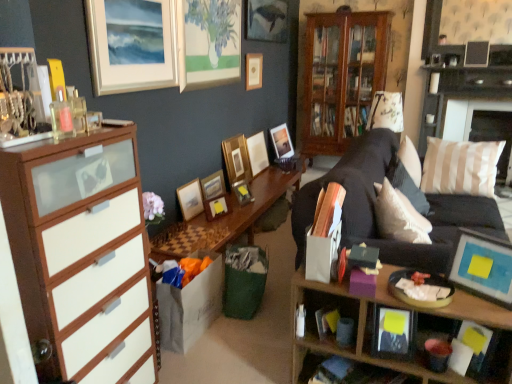
Question: Is wooden picture frame at upper center, which ranks as the 3th picture frame in back-to-front order, in contact with matte wooden picture frame at upper center, which ranks as the first picture frame in back-to-front order?

Choices:
 (A) no
 (B) yes

Answer: (A)

Question: From the image's perspective, is wooden picture frame at upper center, which ranks as the 3th picture frame in back-to-front order, located beneath matte wooden picture frame at upper center, which ranks as the first picture frame in back-to-front order?

Choices:
 (A) no
 (B) yes

Answer: (A)

Question: Are wooden picture frame at upper center, which ranks as the 3th picture frame in back-to-front order, and matte wooden picture frame at upper center, which ranks as the first picture frame in back-to-front order, located far from each other?

Choices:
 (A) yes
 (B) no

Answer: (B)

Question: Is matte wooden picture frame at upper center, which ranks as the first picture frame in back-to-front order, surrounded by wooden picture frame at upper center, placed as the ninth picture frame when sorted from front to back?

Choices:
 (A) no
 (B) yes

Answer: (A)

Question: Is wooden picture frame at upper center, placed as the ninth picture frame when sorted from front to back, facing away from matte wooden picture frame at upper center, which is the 11th picture frame in front-to-back order?

Choices:
 (A) yes
 (B) no

Answer: (B)

Question: Is point (312, 336) closer or farther from the camera than point (342, 307)?

Choices:
 (A) closer
 (B) farther

Answer: (A)

Question: Considering the positions of wooden shelf at lower right and wooden cabinet at lower right in the image, is wooden shelf at lower right taller or shorter than wooden cabinet at lower right?

Choices:
 (A) short
 (B) tall

Answer: (B)

Question: Is wooden shelf at lower right inside the boundaries of wooden cabinet at lower right, or outside?

Choices:
 (A) outside
 (B) inside

Answer: (A)

Question: Is wooden shelf at lower right wider or thinner than wooden cabinet at lower right?

Choices:
 (A) thin
 (B) wide

Answer: (B)

Question: Considering the relative positions of wooden picture frame at center, the fourth picture frame from the back, and matte silver picture frame at upper left, positioned as the ninth picture frame in back-to-front order, in the image provided, is wooden picture frame at center, the fourth picture frame from the back, to the left or to the right of matte silver picture frame at upper left, positioned as the ninth picture frame in back-to-front order,?

Choices:
 (A) right
 (B) left

Answer: (A)

Question: Is wooden picture frame at center, which is the 8th picture frame from front to back, spatially inside matte silver picture frame at upper left, the third picture frame positioned from the front, or outside of it?

Choices:
 (A) outside
 (B) inside

Answer: (A)

Question: Is point (246, 167) closer or farther from the camera than point (97, 13)?

Choices:
 (A) farther
 (B) closer

Answer: (A)

Question: From the image's perspective, is wooden picture frame at center, which is the 8th picture frame from front to back, above or below matte silver picture frame at upper left, the third picture frame positioned from the front?

Choices:
 (A) above
 (B) below

Answer: (B)

Question: Considering the positions of wooden cabinet at lower right and wooden picture frame at center, which is the 8th picture frame from front to back, in the image, is wooden cabinet at lower right taller or shorter than wooden picture frame at center, which is the 8th picture frame from front to back,?

Choices:
 (A) short
 (B) tall

Answer: (A)

Question: From a real-world perspective, is wooden cabinet at lower right physically located above or below wooden picture frame at center, which is the 8th picture frame from front to back?

Choices:
 (A) above
 (B) below

Answer: (B)